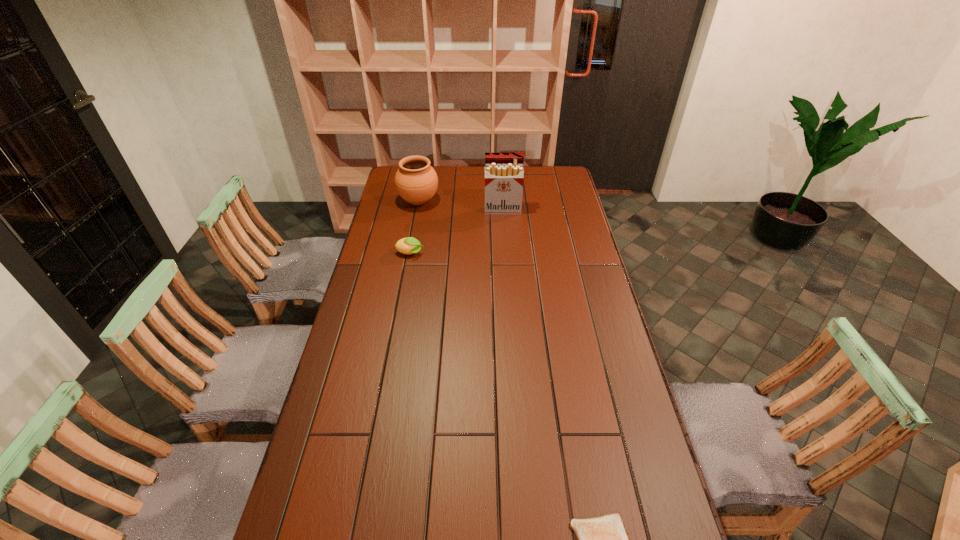
Identify the location of vacant space that is in between the second nearest object and the pottery. This screenshot has height=540, width=960. (414, 227).

Locate an element on the screen. vacant area that lies between the lemon and the second tallest object is located at coordinates (414, 227).

At what (x,y) coordinates should I click in order to perform the action: click on blank region between the third shortest object and the second shortest object. Please return your answer as a coordinate pair (x, y). This screenshot has height=540, width=960. Looking at the image, I should click on (414, 227).

Identify which object is the third closest to the third shortest object. Please provide its 2D coordinates. Your answer should be formatted as a tuple, i.e. [(x, y)], where the tuple contains the x and y coordinates of a point satisfying the conditions above.

[(604, 539)]

Select which object appears as the third closest to the second shortest object. Please provide its 2D coordinates. Your answer should be formatted as a tuple, i.e. [(x, y)], where the tuple contains the x and y coordinates of a point satisfying the conditions above.

[(604, 539)]

Where is `vacant space that satisfies the following two spatial constraints: 1. with the lid open on the second object from right to left; 2. with leaves positioned above the third farthest object`? This screenshot has width=960, height=540. vacant space that satisfies the following two spatial constraints: 1. with the lid open on the second object from right to left; 2. with leaves positioned above the third farthest object is located at coordinates (506, 254).

Image resolution: width=960 pixels, height=540 pixels. Identify the location of free space that satisfies the following two spatial constraints: 1. with the lid open on the cigarette case; 2. with leaves positioned above the third tallest object. (506, 254).